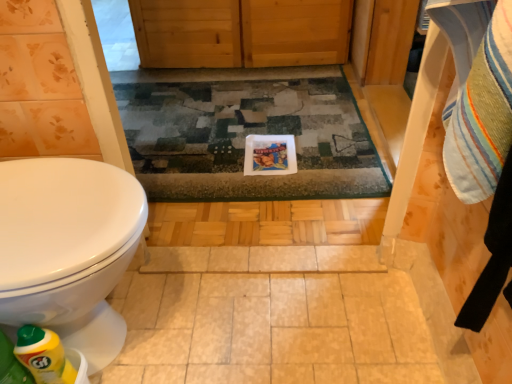
Question: Is point (23, 354) closer or farther from the camera than point (153, 74)?

Choices:
 (A) closer
 (B) farther

Answer: (A)

Question: Relative to multicolored woven rug at center, is yellow plastic bottle at lower left in front or behind?

Choices:
 (A) front
 (B) behind

Answer: (A)

Question: Looking at the image, does yellow plastic bottle at lower left seem bigger or smaller compared to multicolored woven rug at center?

Choices:
 (A) big
 (B) small

Answer: (B)

Question: Considering the positions of multicolored woven rug at center and yellow plastic bottle at lower left in the image, is multicolored woven rug at center bigger or smaller than yellow plastic bottle at lower left?

Choices:
 (A) small
 (B) big

Answer: (B)

Question: Is point (158, 190) positioned closer to the camera than point (69, 370)?

Choices:
 (A) farther
 (B) closer

Answer: (A)

Question: From a real-world perspective, is multicolored woven rug at center above or below yellow plastic bottle at lower left?

Choices:
 (A) above
 (B) below

Answer: (B)

Question: Is multicolored woven rug at center wider or thinner than yellow plastic bottle at lower left?

Choices:
 (A) thin
 (B) wide

Answer: (B)